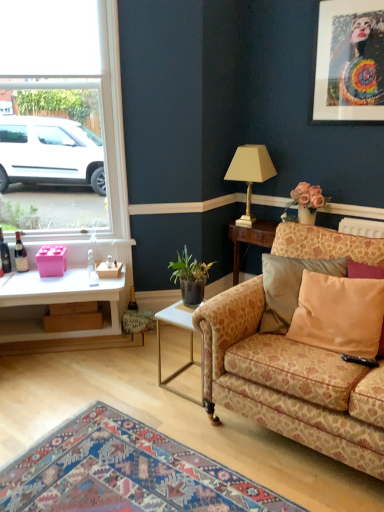
Locate an element on the screen. Image resolution: width=384 pixels, height=512 pixels. free space in front of white metal side table at lower center is located at coordinates (197, 422).